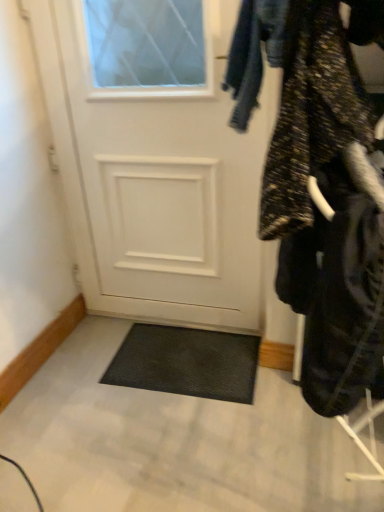
Question: Can textured black coat at right be found inside white matte door at center?

Choices:
 (A) yes
 (B) no

Answer: (B)

Question: Does white matte door at center have a greater width compared to textured black coat at right?

Choices:
 (A) yes
 (B) no

Answer: (B)

Question: Is white matte door at center directly adjacent to textured black coat at right?

Choices:
 (A) no
 (B) yes

Answer: (A)

Question: Can we say white matte door at center lies outside textured black coat at right?

Choices:
 (A) no
 (B) yes

Answer: (B)

Question: Is white matte door at center smaller than textured black coat at right?

Choices:
 (A) no
 (B) yes

Answer: (B)

Question: From the image's perspective, is white matte door at center under textured black coat at right?

Choices:
 (A) yes
 (B) no

Answer: (B)

Question: From a real-world perspective, is textured black coat at right located beneath white matte door at center?

Choices:
 (A) yes
 (B) no

Answer: (B)

Question: Is textured black coat at right far from white matte door at center?

Choices:
 (A) no
 (B) yes

Answer: (A)

Question: Is textured black coat at right facing away from white matte door at center?

Choices:
 (A) yes
 (B) no

Answer: (B)

Question: Is textured black coat at right at the right side of white matte door at center?

Choices:
 (A) yes
 (B) no

Answer: (A)

Question: Is textured black coat at right positioned before white matte door at center?

Choices:
 (A) yes
 (B) no

Answer: (A)

Question: From a real-world perspective, is textured black coat at right on white matte door at center?

Choices:
 (A) yes
 (B) no

Answer: (A)

Question: Is white matte door at center bigger or smaller than textured black coat at right?

Choices:
 (A) small
 (B) big

Answer: (A)